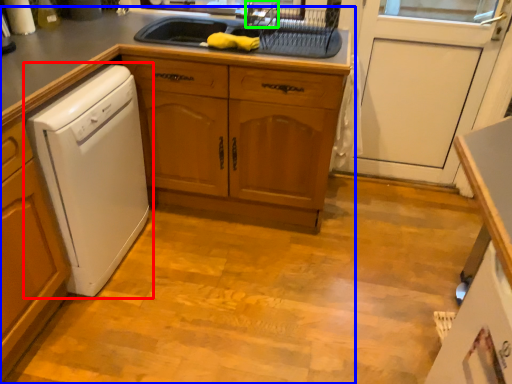
Question: Which object is the closest to the home appliance (highlighted by a red box)? Choose among these: countertop (highlighted by a blue box) or faucet (highlighted by a green box).

Choices:
 (A) countertop
 (B) faucet

Answer: (A)